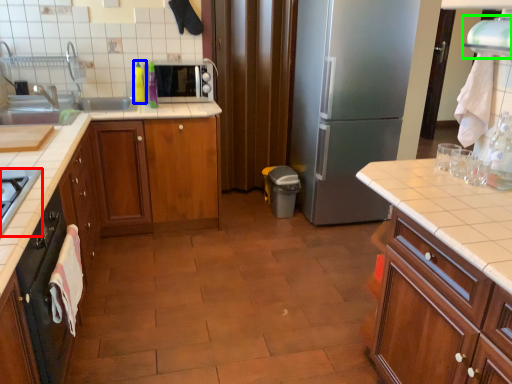
Question: Which is nearer to the gas stove (highlighted by a red box)? bottle (highlighted by a blue box) or exhaust hood (highlighted by a green box).

Choices:
 (A) bottle
 (B) exhaust hood

Answer: (A)